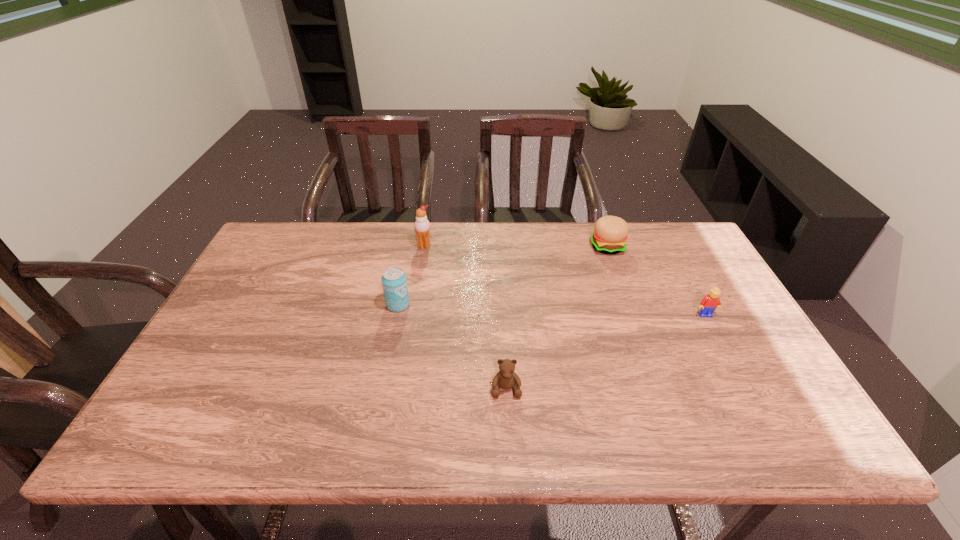
I want to click on vacant space located on the front-facing side of the third object from right to left, so click(508, 424).

Identify the location of icecream that is at the far edge. 422,226.

Find the location of a particular element. hamburger at the far edge is located at coordinates (610, 233).

At what (x,y) coordinates should I click in order to perform the action: click on object at the right edge. Please return your answer as a coordinate pair (x, y). The image size is (960, 540). Looking at the image, I should click on (708, 304).

Where is `vacant area at the far edge of the desktop`? This screenshot has width=960, height=540. vacant area at the far edge of the desktop is located at coordinates (623, 260).

Image resolution: width=960 pixels, height=540 pixels. What are the coordinates of `vacant space at the near edge of the desktop` in the screenshot? It's located at (706, 423).

Where is `free space at the left edge of the desktop`? The width and height of the screenshot is (960, 540). free space at the left edge of the desktop is located at coordinates (263, 309).

Locate an element on the screen. The width and height of the screenshot is (960, 540). blank space at the near left corner is located at coordinates (184, 428).

In the image, there is a desktop. Identify the location of free space at the far right corner. (696, 252).

In order to click on vacant space that is in between the rightmost object and the beer can in this screenshot , I will do `click(552, 310)`.